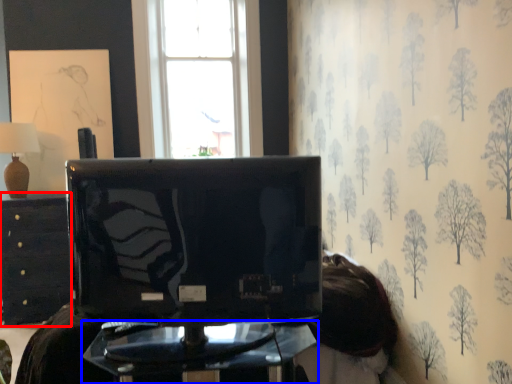
Question: Among these objects, which one is farthest to the camera, furniture (highlighted by a red box) or furniture (highlighted by a blue box)?

Choices:
 (A) furniture
 (B) furniture

Answer: (A)